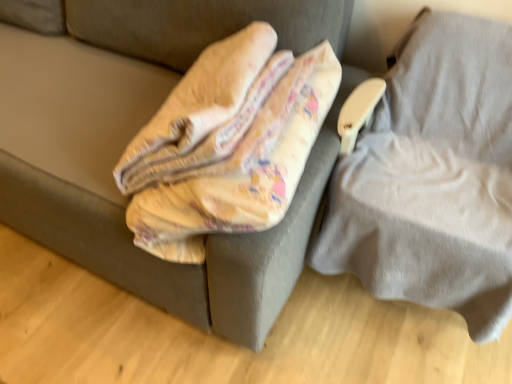
Question: Considering their positions, is gray fabric pillow at right, marked as the 2th furniture in a left-to-right arrangement, located in front of or behind yellow fabric blanket at upper left, which is counted as the first furniture, starting from the left?

Choices:
 (A) behind
 (B) front

Answer: (B)

Question: From a real-world perspective, is gray fabric pillow at right, which appears as the 1th furniture when viewed from the right, physically located above or below yellow fabric blanket at upper left, the second furniture from the right?

Choices:
 (A) below
 (B) above

Answer: (A)

Question: In terms of height, does gray fabric pillow at right, which appears as the 1th furniture when viewed from the right, look taller or shorter compared to yellow fabric blanket at upper left, which is counted as the first furniture, starting from the left?

Choices:
 (A) tall
 (B) short

Answer: (A)

Question: In terms of height, does yellow fabric blanket at upper left, which is counted as the first furniture, starting from the left, look taller or shorter compared to gray fabric pillow at right, which appears as the 1th furniture when viewed from the right?

Choices:
 (A) tall
 (B) short

Answer: (B)

Question: From a real-world perspective, is yellow fabric blanket at upper left, the second furniture from the right, above or below gray fabric pillow at right, marked as the 2th furniture in a left-to-right arrangement?

Choices:
 (A) below
 (B) above

Answer: (B)

Question: Is yellow fabric blanket at upper left, which is counted as the first furniture, starting from the left, to the left or to the right of gray fabric pillow at right, marked as the 2th furniture in a left-to-right arrangement, in the image?

Choices:
 (A) left
 (B) right

Answer: (A)

Question: In the image, is yellow fabric blanket at upper left, the second furniture from the right, positioned in front of or behind gray fabric pillow at right, marked as the 2th furniture in a left-to-right arrangement?

Choices:
 (A) front
 (B) behind

Answer: (B)